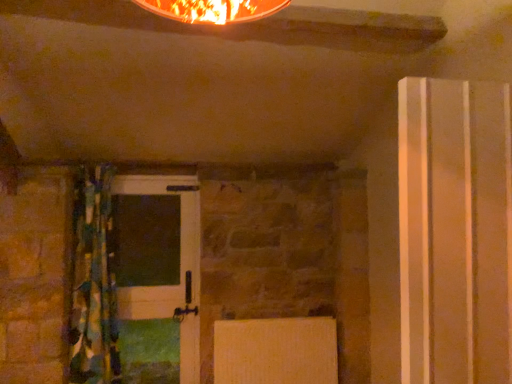
Identify the location of transparent plastic door at right, which is counted as the first door, starting from the right. Image resolution: width=512 pixels, height=384 pixels. (455, 231).

From a real-world perspective, between textured multicolored curtain at left and transparent plastic door at right, which is counted as the first door, starting from the right, who is vertically lower?

In real-world perspective, textured multicolored curtain at left is lower.

Which is correct: textured multicolored curtain at left is inside transparent plastic door at right, which is counted as the first door, starting from the right, or outside of it?

textured multicolored curtain at left lies outside transparent plastic door at right, which is counted as the first door, starting from the right.

The height and width of the screenshot is (384, 512). Find the location of `door that appears in front of the textured multicolored curtain at left`. door that appears in front of the textured multicolored curtain at left is located at coordinates (455, 231).

From the image's perspective, which object appears higher, textured multicolored curtain at left or transparent plastic door at right, which is counted as the 2th door, starting from the back?

transparent plastic door at right, which is counted as the 2th door, starting from the back, is shown above in the image.

Which is more to the left, transparent plastic door at right, the 1th door when ordered from front to back, or white glossy door at center, the 1th door from the back?

white glossy door at center, the 1th door from the back.

Is transparent plastic door at right, the 1th door when ordered from front to back, inside the boundaries of white glossy door at center, the 2th door viewed from the right, or outside?

transparent plastic door at right, the 1th door when ordered from front to back, exists outside the volume of white glossy door at center, the 2th door viewed from the right.

Between transparent plastic door at right, which is the second door in left-to-right order, and white glossy door at center, the 1th door from the back, which one has larger size?

With larger size is transparent plastic door at right, which is the second door in left-to-right order.

From a real-world perspective, is transparent plastic door at right, which is the second door in left-to-right order, located higher than white glossy door at center, acting as the 2th door starting from the front?

Yes, from a real-world perspective, transparent plastic door at right, which is the second door in left-to-right order, is above white glossy door at center, acting as the 2th door starting from the front.

Is point (88, 250) farther from viewer compared to point (128, 262)?

No, it is not.

From the image's perspective, which one is positioned lower, textured multicolored curtain at left or white glossy door at center, the 1th door in the left-to-right sequence?

white glossy door at center, the 1th door in the left-to-right sequence, is shown below in the image.

Does textured multicolored curtain at left turn towards white glossy door at center, acting as the 2th door starting from the front?

No, textured multicolored curtain at left is not oriented towards white glossy door at center, acting as the 2th door starting from the front.

Is textured multicolored curtain at left positioned in front of white glossy door at center, the 1th door in the left-to-right sequence?

Yes, textured multicolored curtain at left is closer to the camera.

Is white glossy door at center, acting as the 2th door starting from the front, aimed at textured multicolored curtain at left?

Yes, white glossy door at center, acting as the 2th door starting from the front, is turned towards textured multicolored curtain at left.

Which object is further away from the camera taking this photo, white glossy door at center, the 1th door in the left-to-right sequence, or textured multicolored curtain at left?

white glossy door at center, the 1th door in the left-to-right sequence, is more distant.

Do you think white glossy door at center, the 2th door viewed from the right, is within textured multicolored curtain at left, or outside of it?

white glossy door at center, the 2th door viewed from the right, cannot be found inside textured multicolored curtain at left.

Consider the image. From the image's perspective, is white glossy door at center, the 1th door from the back, positioned above or below textured multicolored curtain at left?

white glossy door at center, the 1th door from the back, is below textured multicolored curtain at left.

Considering the relative sizes of transparent plastic door at right, which is counted as the 2th door, starting from the back, and textured multicolored curtain at left in the image provided, is transparent plastic door at right, which is counted as the 2th door, starting from the back, taller than textured multicolored curtain at left?

In fact, transparent plastic door at right, which is counted as the 2th door, starting from the back, may be shorter than textured multicolored curtain at left.

Which is behind, point (430, 276) or point (75, 206)?

Positioned behind is point (75, 206).

Is transparent plastic door at right, which is counted as the 2th door, starting from the back, looking in the opposite direction of textured multicolored curtain at left?

No.

From the image's perspective, is transparent plastic door at right, which is counted as the first door, starting from the right, above textured multicolored curtain at left?

Yes, from the image's perspective, transparent plastic door at right, which is counted as the first door, starting from the right, is above textured multicolored curtain at left.

From the picture: Is white glossy door at center, the 1th door from the back, completely or partially outside of transparent plastic door at right, which is counted as the first door, starting from the right?

white glossy door at center, the 1th door from the back, lies outside transparent plastic door at right, which is counted as the first door, starting from the right,'s area.

Considering the relative sizes of white glossy door at center, the 1th door in the left-to-right sequence, and transparent plastic door at right, which is the second door in left-to-right order, in the image provided, is white glossy door at center, the 1th door in the left-to-right sequence, smaller than transparent plastic door at right, which is the second door in left-to-right order,?

Correct, white glossy door at center, the 1th door in the left-to-right sequence, occupies less space than transparent plastic door at right, which is the second door in left-to-right order.

Considering their positions, is white glossy door at center, the 1th door from the back, located in front of or behind transparent plastic door at right, which is counted as the first door, starting from the right?

white glossy door at center, the 1th door from the back, is behind transparent plastic door at right, which is counted as the first door, starting from the right.

I want to click on door in front of the textured multicolored curtain at left, so 455,231.

At what (x,y) coordinates should I click in order to perform the action: click on door above the white glossy door at center, the 2th door viewed from the right (from a real-world perspective). Please return your answer as a coordinate pair (x, y). Image resolution: width=512 pixels, height=384 pixels. Looking at the image, I should click on (455, 231).

When comparing their distances from textured multicolored curtain at left, does transparent plastic door at right, which is the second door in left-to-right order, or white glossy door at center, the 1th door from the back, seem closer?

white glossy door at center, the 1th door from the back, is positioned closer to the anchor textured multicolored curtain at left.

Considering their positions, is textured multicolored curtain at left positioned closer to white glossy door at center, the 2th door viewed from the right, than transparent plastic door at right, the 1th door when ordered from front to back?

textured multicolored curtain at left lies closer to white glossy door at center, the 2th door viewed from the right, than the other object.

Considering their positions, is white glossy door at center, the 1th door in the left-to-right sequence, positioned further to transparent plastic door at right, the 1th door when ordered from front to back, than textured multicolored curtain at left?

textured multicolored curtain at left.

Looking at the image, which one is located closer to transparent plastic door at right, the 1th door when ordered from front to back, textured multicolored curtain at left or white glossy door at center, the 1th door in the left-to-right sequence?

white glossy door at center, the 1th door in the left-to-right sequence, is closer to transparent plastic door at right, the 1th door when ordered from front to back.

Considering their positions, is white glossy door at center, acting as the 2th door starting from the front, positioned closer to textured multicolored curtain at left than transparent plastic door at right, which is the second door in left-to-right order?

The object closer to textured multicolored curtain at left is white glossy door at center, acting as the 2th door starting from the front.

When comparing their distances from white glossy door at center, the 2th door viewed from the right, does transparent plastic door at right, which is counted as the first door, starting from the right, or textured multicolored curtain at left seem closer?

Based on the image, textured multicolored curtain at left appears to be nearer to white glossy door at center, the 2th door viewed from the right.

This screenshot has width=512, height=384. I want to click on curtain between transparent plastic door at right, which is the second door in left-to-right order, and white glossy door at center, the 1th door from the back, from front to back, so click(x=93, y=282).